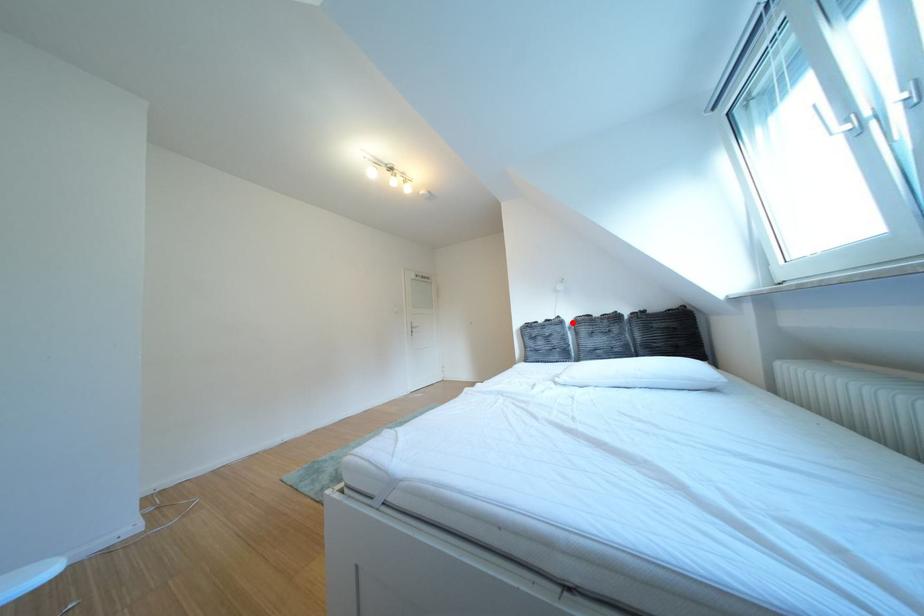
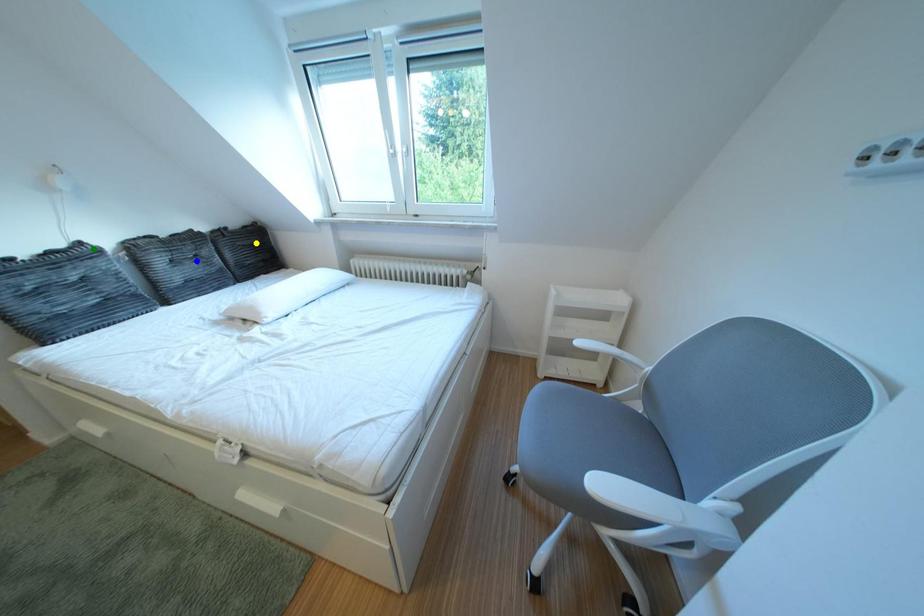
Question: I am providing you with two images of the same scene from different viewpoints. A red point is marked on the first image. You are given multiple points on the second image. Can you choose the point in image 2 that corresponds to the point in image 1?

Choices:
 (A) blue point
 (B) yellow point
 (C) green point

Answer: (C)